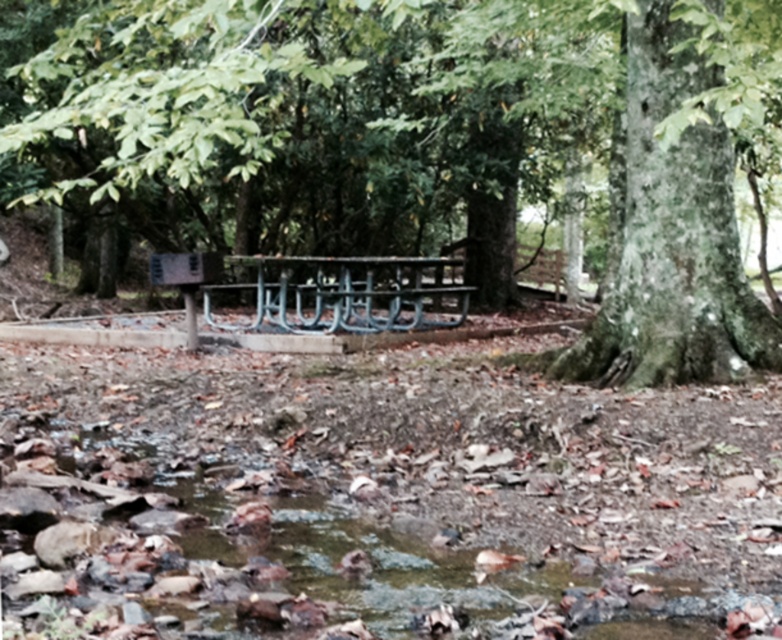
Question: Which object is farther from the camera taking this photo?

Choices:
 (A) clear water at center
 (B) green painted metal bench at center
 (C) green rough bark tree at center

Answer: (B)

Question: Can you confirm if clear water at center is positioned to the left of green painted metal bench at center?

Choices:
 (A) no
 (B) yes

Answer: (B)

Question: Is green rough bark tree at center bigger than clear water at center?

Choices:
 (A) no
 (B) yes

Answer: (B)

Question: Which of the following is the farthest from the observer?

Choices:
 (A) green painted metal bench at center
 (B) clear water at center

Answer: (A)

Question: Which object appears farthest from the camera in this image?

Choices:
 (A) green painted metal bench at center
 (B) clear water at center
 (C) green rough bark tree at center

Answer: (A)

Question: Is green rough bark tree at center thinner than clear water at center?

Choices:
 (A) no
 (B) yes

Answer: (A)